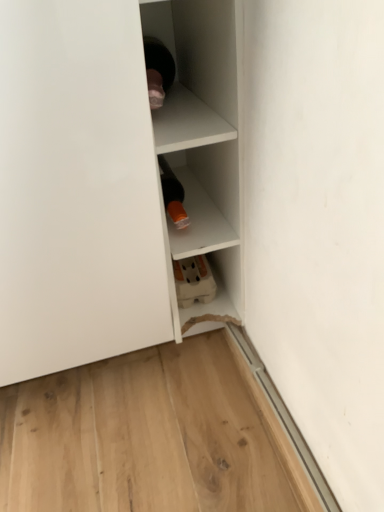
Question: In terms of width, does white matte shelf at upper left, the 2th shelf positioned from the right, look wider or thinner when compared to white matte shelf at center, positioned as the 1th shelf in right-to-left order?

Choices:
 (A) thin
 (B) wide

Answer: (B)

Question: Do you think white matte shelf at upper left, the 1th shelf positioned from the left, is within white matte shelf at center, which appears as the second shelf when viewed from the left, or outside of it?

Choices:
 (A) outside
 (B) inside

Answer: (A)

Question: Is white matte shelf at upper left, the 1th shelf positioned from the left, to the left or to the right of white matte shelf at center, which appears as the second shelf when viewed from the left, in the image?

Choices:
 (A) right
 (B) left

Answer: (B)

Question: From a real-world perspective, is white matte shelf at center, positioned as the 1th shelf in right-to-left order, positioned above or below white matte shelf at upper left, the 1th shelf positioned from the left?

Choices:
 (A) below
 (B) above

Answer: (A)

Question: Would you say white matte shelf at center, positioned as the 1th shelf in right-to-left order, is inside or outside white matte shelf at upper left, the 1th shelf positioned from the left?

Choices:
 (A) inside
 (B) outside

Answer: (B)

Question: Visually, is white matte shelf at center, which appears as the second shelf when viewed from the left, positioned to the left or to the right of white matte shelf at upper left, the 1th shelf positioned from the left?

Choices:
 (A) right
 (B) left

Answer: (A)

Question: Considering the positions of point (235, 210) and point (236, 80), is point (235, 210) closer or farther from the camera than point (236, 80)?

Choices:
 (A) closer
 (B) farther

Answer: (B)